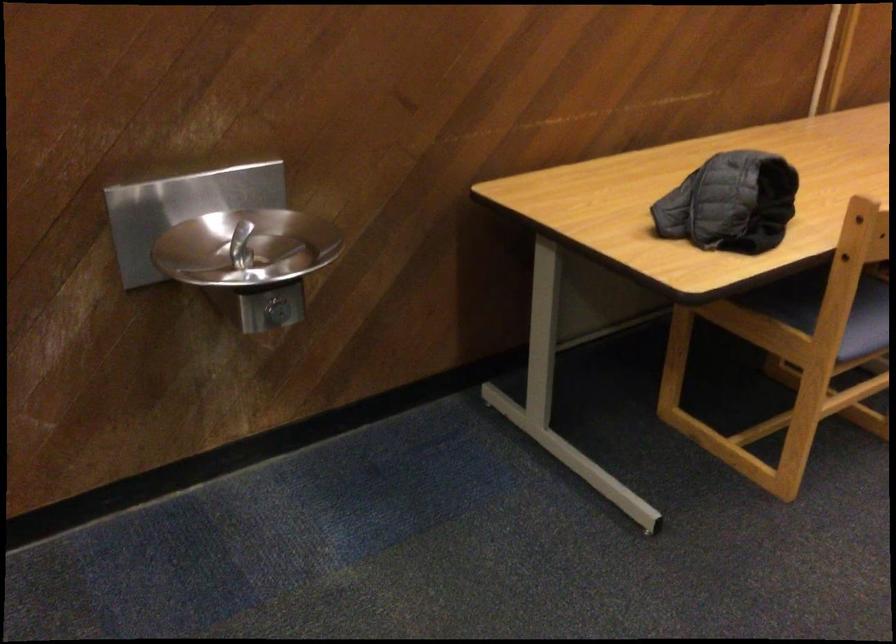
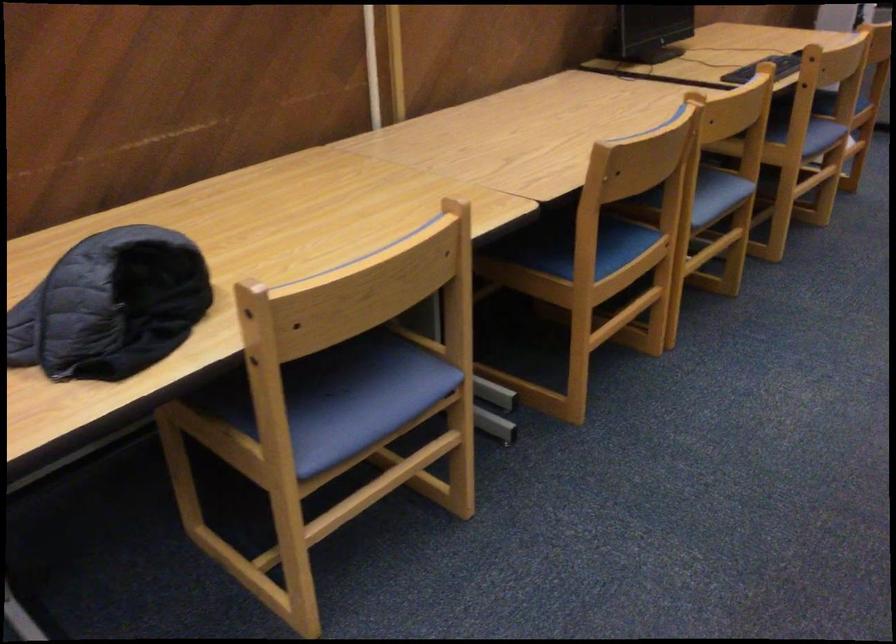
Looking at this image, what movement of the cameraman would produce the second image?

The movement direction of the cameraman is right, forward.